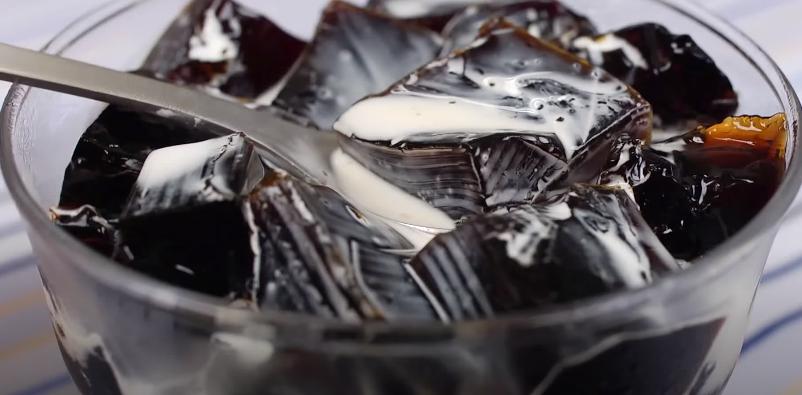
What are the coordinates of `glass bowl` in the screenshot? It's located at (164, 351).